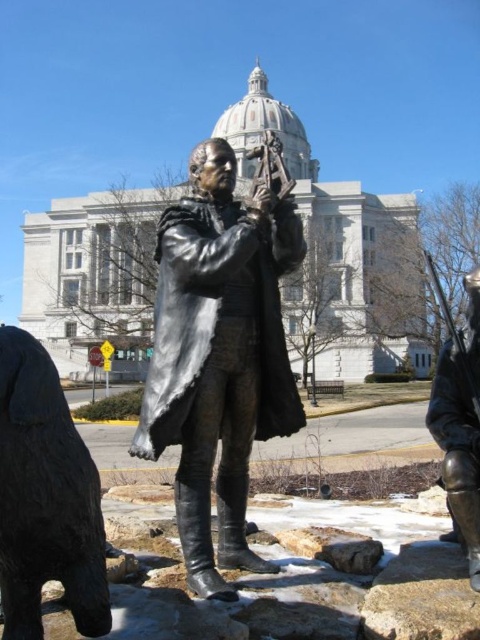
Which is more to the left, black polished bear at lower left or bronze statue at right?

black polished bear at lower left

Is black polished bear at lower left thinner than bronze statue at right?

Yes.

Is point (27, 560) less distant than point (432, 410)?

That is True.

What are the coordinates of `black polished bear at lower left` in the screenshot? It's located at (46, 497).

From the picture: Between bronze statue at center and black polished bear at lower left, which one is positioned higher?

bronze statue at center is above.

Can you confirm if bronze statue at center is shorter than black polished bear at lower left?

In fact, bronze statue at center may be taller than black polished bear at lower left.

What do you see at coordinates (218, 356) in the screenshot?
I see `bronze statue at center` at bounding box center [218, 356].

Find the location of `bronze statue at center`. bronze statue at center is located at coordinates point(218,356).

Does bronze statue at center appear over bronze statue at right?

Incorrect, bronze statue at center is not positioned above bronze statue at right.

Is point (228, 538) closer to viewer compared to point (450, 476)?

That is False.

The image size is (480, 640). Identify the location of bronze statue at center. (218, 356).